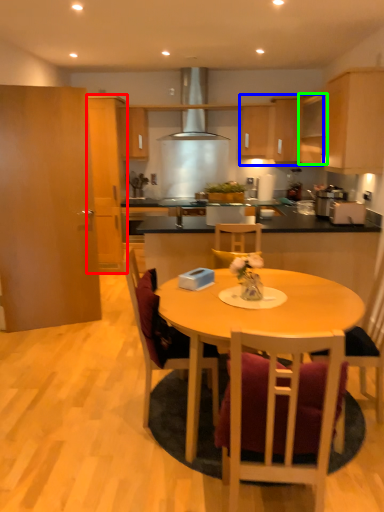
Question: Considering the real-world distances, which object is farthest from cabinetry (highlighted by a red box)? cabinetry (highlighted by a blue box) or cabinetry (highlighted by a green box)?

Choices:
 (A) cabinetry
 (B) cabinetry

Answer: (B)